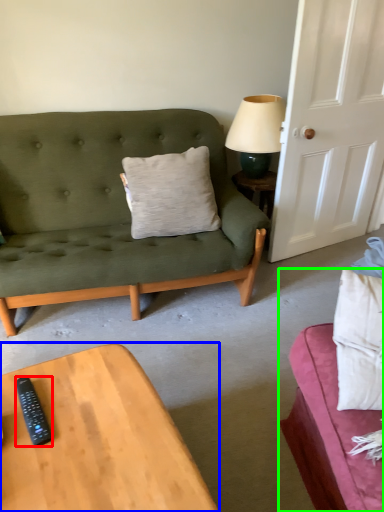
Question: Considering the real-world distances, which object is farthest from remote control (highlighted by a red box)? coffee table (highlighted by a blue box) or studio couch (highlighted by a green box)?

Choices:
 (A) coffee table
 (B) studio couch

Answer: (B)